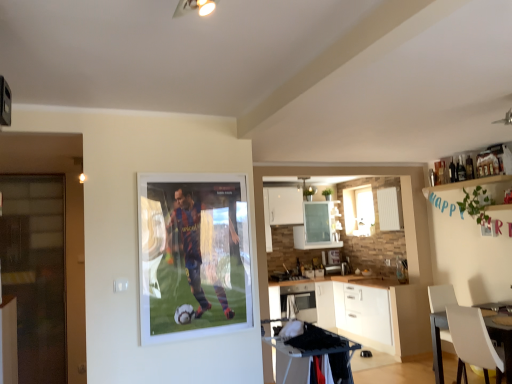
Question: Is white plastic chair at lower right to the right of white glossy cabinet at lower center from the viewer's perspective?

Choices:
 (A) no
 (B) yes

Answer: (B)

Question: From the image's perspective, would you say white plastic chair at lower right is positioned over white glossy cabinet at lower center?

Choices:
 (A) yes
 (B) no

Answer: (A)

Question: Could white glossy cabinet at lower center be considered to be inside white plastic chair at lower right?

Choices:
 (A) yes
 (B) no

Answer: (B)

Question: Is white plastic chair at lower right positioned in front of white glossy cabinet at lower center?

Choices:
 (A) yes
 (B) no

Answer: (A)

Question: Considering the relative sizes of white plastic chair at lower right and white glossy cabinet at lower center in the image provided, is white plastic chair at lower right taller than white glossy cabinet at lower center?

Choices:
 (A) yes
 (B) no

Answer: (B)

Question: From the image's perspective, is white glossy window at center above or below white glossy microwave at center?

Choices:
 (A) above
 (B) below

Answer: (A)

Question: From a real-world perspective, is white glossy window at center above or below white glossy microwave at center?

Choices:
 (A) above
 (B) below

Answer: (A)

Question: In terms of width, does white glossy window at center look wider or thinner when compared to white glossy microwave at center?

Choices:
 (A) thin
 (B) wide

Answer: (A)

Question: Do you think white glossy window at center is within white glossy microwave at center, or outside of it?

Choices:
 (A) inside
 (B) outside

Answer: (B)

Question: From the image's perspective, is white glossy window at center located above or below transparent glass door at left?

Choices:
 (A) above
 (B) below

Answer: (A)

Question: Looking at their shapes, would you say white glossy window at center is wider or thinner than transparent glass door at left?

Choices:
 (A) thin
 (B) wide

Answer: (A)

Question: Considering the positions of point (360, 235) and point (50, 218), is point (360, 235) closer or farther from the camera than point (50, 218)?

Choices:
 (A) closer
 (B) farther

Answer: (B)

Question: From a real-world perspective, is white glossy window at center above or below transparent glass door at left?

Choices:
 (A) above
 (B) below

Answer: (A)

Question: In terms of width, does transparent glass door at left look wider or thinner when compared to white glossy cabinet at lower center?

Choices:
 (A) thin
 (B) wide

Answer: (A)

Question: Considering their positions, is transparent glass door at left located in front of or behind white glossy cabinet at lower center?

Choices:
 (A) behind
 (B) front

Answer: (B)